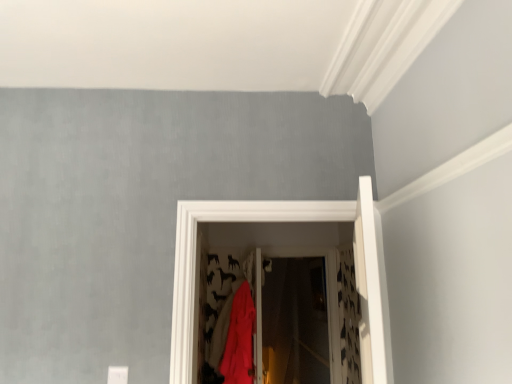
The height and width of the screenshot is (384, 512). What do you see at coordinates (236, 338) in the screenshot? I see `matte red fabric at center` at bounding box center [236, 338].

This screenshot has width=512, height=384. What are the coordinates of `matte red fabric at center` in the screenshot? It's located at (x=236, y=338).

In order to face matte red fabric at center, should I rotate leftwards or rightwards?

Turn left approximately 3.661 degrees to face it.

What is the approximate width of transparent plastic screen door at center?

The width of transparent plastic screen door at center is 4.37 inches.

In order to face transparent plastic screen door at center, should I rotate leftwards or rightwards?

To align with it, rotate right about 6.076°.

You are a GUI agent. You are given a task and a screenshot of the screen. Output one action in this format:
    pyautogui.click(x=<x>, y=<y>)
    Task: Click on the transparent plastic screen door at center
    
    Given the screenshot: What is the action you would take?
    pyautogui.click(x=298, y=323)

Describe the element at coordinates (298, 323) in the screenshot. The height and width of the screenshot is (384, 512). I see `transparent plastic screen door at center` at that location.

Identify the location of matte red fabric at center. The image size is (512, 384). (236, 338).

Considering the relative positions of matte red fabric at center and transparent plastic screen door at center in the image provided, is matte red fabric at center to the left of transparent plastic screen door at center from the viewer's perspective?

Indeed, matte red fabric at center is positioned on the left side of transparent plastic screen door at center.

Considering the relative positions of matte red fabric at center and transparent plastic screen door at center in the image provided, is matte red fabric at center behind transparent plastic screen door at center?

No, it is not.

Is point (250, 328) positioned after point (267, 383)?

No, it is in front of (267, 383).

From the image's perspective, between matte red fabric at center and transparent plastic screen door at center, which one is located above?

From the image's view, transparent plastic screen door at center is above.

From a real-world perspective, which object stands above the other?

In real-world perspective, transparent plastic screen door at center is above.

Consider the image. Considering the sizes of matte red fabric at center and transparent plastic screen door at center in the image, is matte red fabric at center wider or thinner than transparent plastic screen door at center?

In the image, matte red fabric at center appears to be wider than transparent plastic screen door at center.

From their relative heights in the image, would you say matte red fabric at center is taller or shorter than transparent plastic screen door at center?

Clearly, matte red fabric at center is shorter compared to transparent plastic screen door at center.

Based on the photo, in terms of size, does matte red fabric at center appear bigger or smaller than transparent plastic screen door at center?

Clearly, matte red fabric at center is larger in size than transparent plastic screen door at center.

Can we say matte red fabric at center lies outside transparent plastic screen door at center?

matte red fabric at center is positioned outside transparent plastic screen door at center.

Is matte red fabric at center touching transparent plastic screen door at center?

No.

Is matte red fabric at center looking in the opposite direction of transparent plastic screen door at center?

matte red fabric at center is not turned away from transparent plastic screen door at center.

This screenshot has height=384, width=512. I want to click on screen door located above the matte red fabric at center (from a real-world perspective), so click(x=298, y=323).

Is transparent plastic screen door at center at the right side of matte red fabric at center?

Indeed, transparent plastic screen door at center is positioned on the right side of matte red fabric at center.

Considering the positions of objects transparent plastic screen door at center and matte red fabric at center in the image provided, who is behind, transparent plastic screen door at center or matte red fabric at center?

transparent plastic screen door at center.

Considering the points (271, 317) and (245, 316), which point is behind, point (271, 317) or point (245, 316)?

The point (271, 317) is more distant.

From the image's perspective, which is above, transparent plastic screen door at center or matte red fabric at center?

From the image's view, transparent plastic screen door at center is above.

From a real-world perspective, is transparent plastic screen door at center positioned over matte red fabric at center based on gravity?

Yes, from a real-world perspective, transparent plastic screen door at center is on top of matte red fabric at center.

Looking at their sizes, would you say transparent plastic screen door at center is wider or thinner than matte red fabric at center?

In the image, transparent plastic screen door at center appears to be more narrow than matte red fabric at center.

Who is taller, transparent plastic screen door at center or matte red fabric at center?

transparent plastic screen door at center is taller.

Is transparent plastic screen door at center bigger or smaller than matte red fabric at center?

Considering their sizes, transparent plastic screen door at center takes up less space than matte red fabric at center.

Is transparent plastic screen door at center outside of matte red fabric at center?

Indeed, transparent plastic screen door at center is completely outside matte red fabric at center.

Is transparent plastic screen door at center not near matte red fabric at center?

transparent plastic screen door at center is far away from matte red fabric at center.

Is transparent plastic screen door at center aimed at matte red fabric at center?

No.

How far apart are transparent plastic screen door at center and matte red fabric at center?

transparent plastic screen door at center and matte red fabric at center are 1.20 meters apart from each other.

Where is `clothing on the left side of transparent plastic screen door at center`? The image size is (512, 384). clothing on the left side of transparent plastic screen door at center is located at coordinates (236, 338).

At what (x,y) coordinates should I click in order to perform the action: click on clothing below the transparent plastic screen door at center (from a real-world perspective). Please return your answer as a coordinate pair (x, y). The width and height of the screenshot is (512, 384). Looking at the image, I should click on (236, 338).

Find the location of `clothing that is on the left side of transparent plastic screen door at center`. clothing that is on the left side of transparent plastic screen door at center is located at coordinates (236, 338).